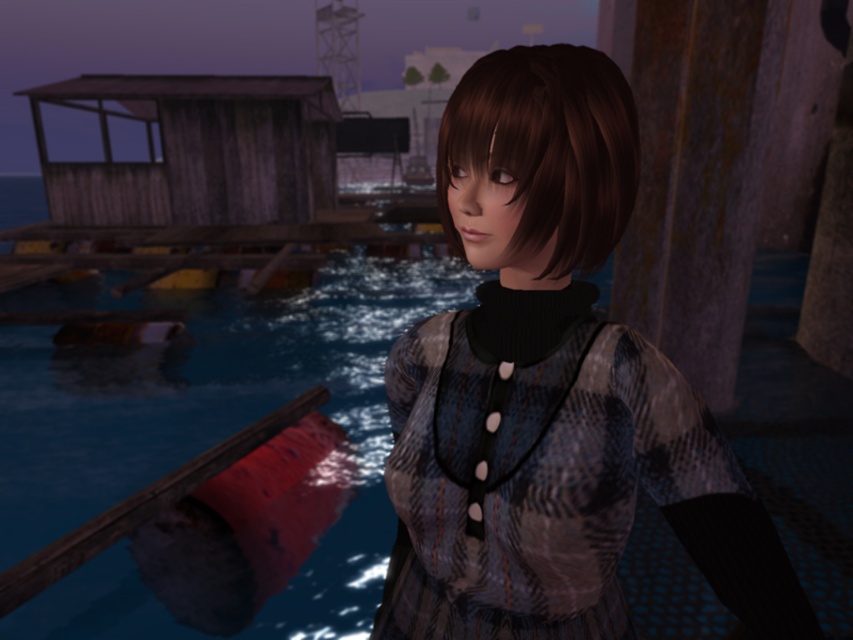
You are a photographer aiming to capture the striped fabric dress at center and the shiny brown hair at center in a single frame. Based on their sizes, will both fit comfortably within the camera frame?

The striped fabric dress at center might be wider than shiny brown hair at center, so there is a possibility that the striped fabric dress at center may not fit comfortably within the camera frame if it is wider than expected. Adjust the camera angle or zoom accordingly.